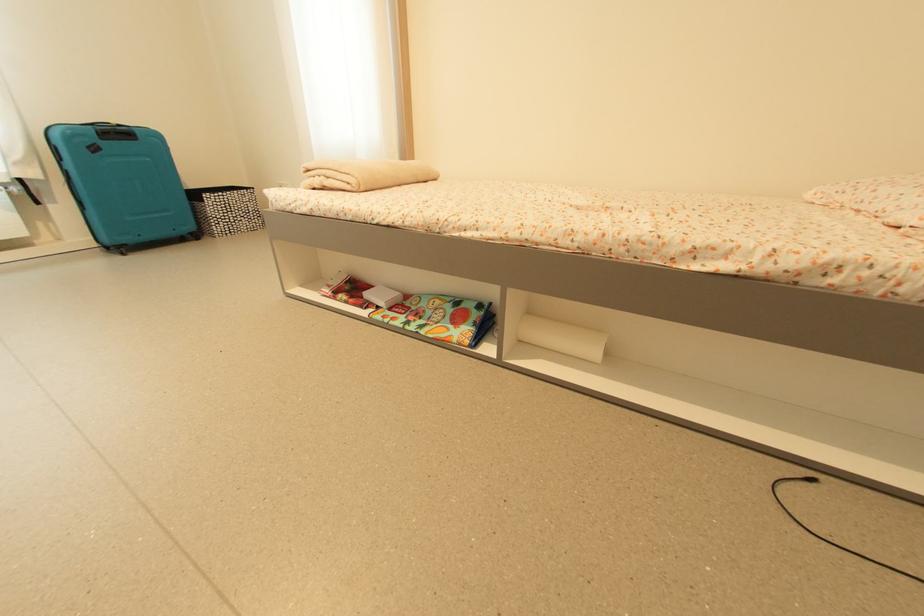
Identify the location of black suitcase handle. (101, 124).